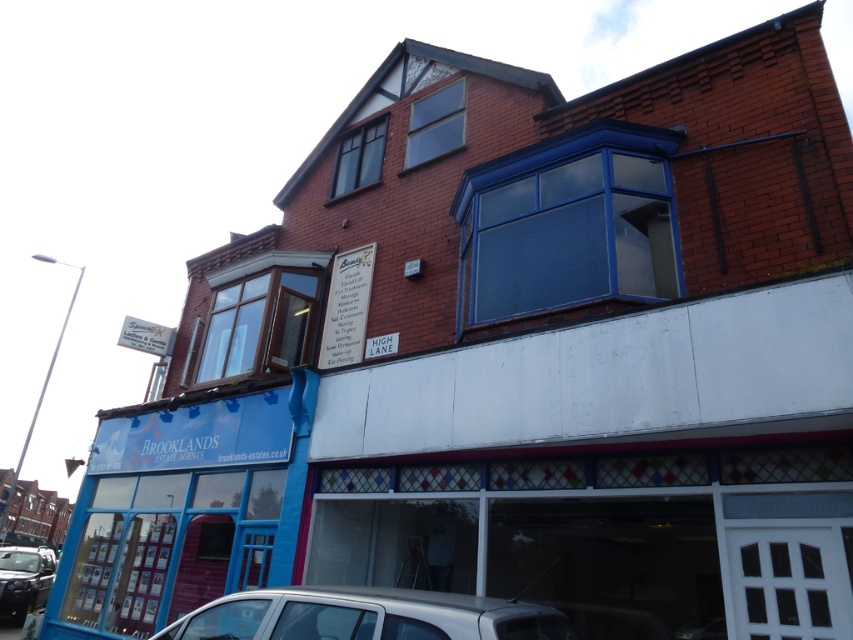
Question: From the image, what is the correct spatial relationship of silver metallic car at lower center in relation to shiny black car at lower left?

Choices:
 (A) left
 (B) right

Answer: (B)

Question: Which point is farther to the camera?

Choices:
 (A) shiny black car at lower left
 (B) silver metallic car at lower center

Answer: (A)

Question: Which of the following is the closest to the observer?

Choices:
 (A) (213, 612)
 (B) (38, 600)

Answer: (A)

Question: Is silver metallic car at lower center positioned in front of shiny black car at lower left?

Choices:
 (A) no
 (B) yes

Answer: (B)

Question: Which point appears farthest from the camera in this image?

Choices:
 (A) (0, 589)
 (B) (245, 595)

Answer: (A)

Question: Can you confirm if silver metallic car at lower center is thinner than shiny black car at lower left?

Choices:
 (A) yes
 (B) no

Answer: (A)